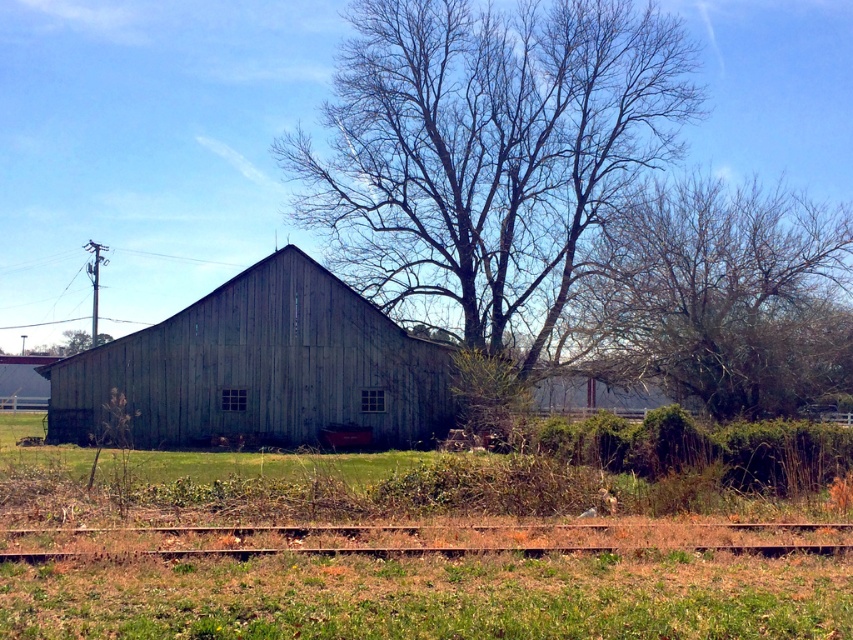
In the scene shown: You are an artist planning to paint this rural scene. You want to ensure the smooth gray bark tree at center and the rusty metal train track at lower center are proportionally accurate. Which object should you draw wider in your painting?

The smooth gray bark tree at center should be drawn wider than the rusty metal train track at lower center because its width surpasses the track.

You are an artist planning to paint the scene. You want to ensure the brown textured tree at upper right and the weathered wood barn at center are proportionally accurate. Which object should you draw with a narrower width in your painting?

The brown textured tree at upper right should be drawn with a narrower width than the weathered wood barn at center because the brown textured tree at upper right is thinner than the weathered wood barn at center.